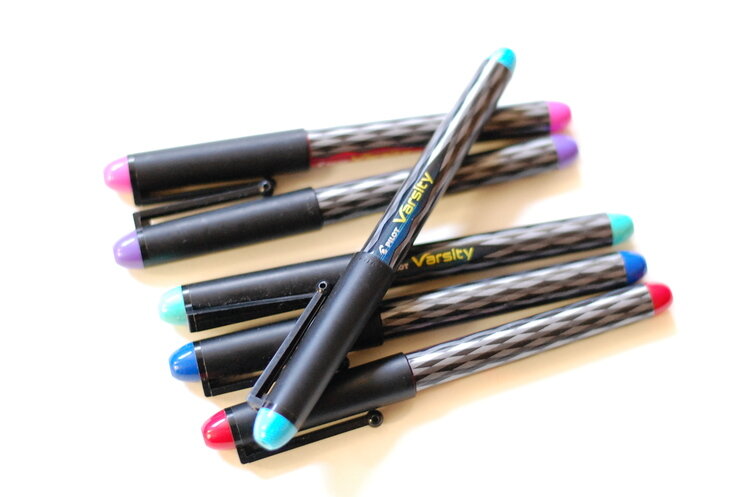
Image resolution: width=750 pixels, height=497 pixels. Identify the location of pens. click(x=405, y=396), click(x=438, y=322), click(x=488, y=252), click(x=405, y=220), click(x=339, y=213), click(x=333, y=144).